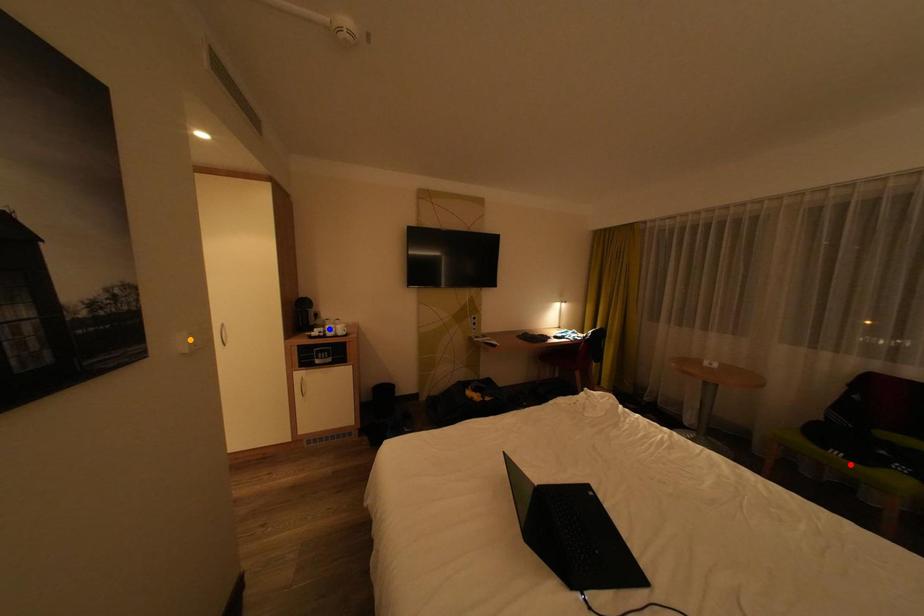
Order these from nearest to farthest:
- orange point
- red point
- blue point

blue point, red point, orange point